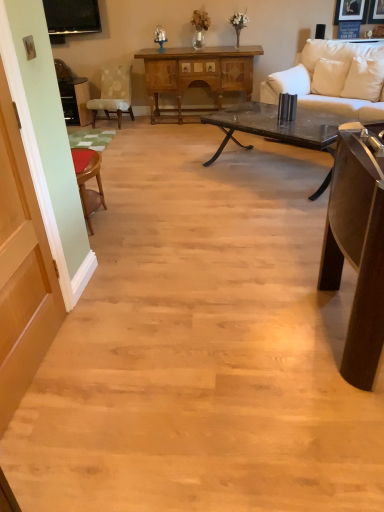
Image resolution: width=384 pixels, height=512 pixels. I want to click on vacant space to the right of transparent glass door at left, so click(x=121, y=368).